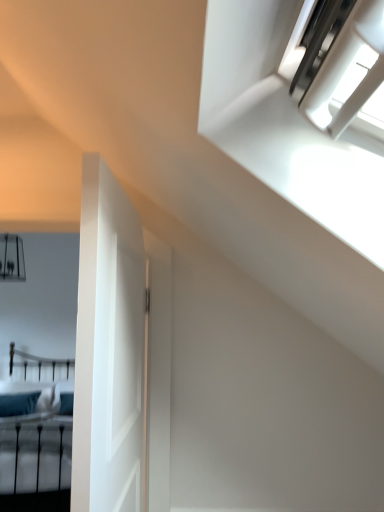
Question: Can you confirm if white matte door at left is wider than teal fabric bed at lower left?

Choices:
 (A) no
 (B) yes

Answer: (A)

Question: Is white matte door at left positioned far away from teal fabric bed at lower left?

Choices:
 (A) yes
 (B) no

Answer: (A)

Question: Is white matte door at left further to camera compared to teal fabric bed at lower left?

Choices:
 (A) no
 (B) yes

Answer: (A)

Question: Considering the relative sizes of white matte door at left and teal fabric bed at lower left in the image provided, is white matte door at left taller than teal fabric bed at lower left?

Choices:
 (A) no
 (B) yes

Answer: (A)

Question: Is white matte door at left beside teal fabric bed at lower left?

Choices:
 (A) no
 (B) yes

Answer: (A)

Question: In terms of width, does teal fabric pillow at lower left look wider or thinner when compared to teal fabric bed at lower left?

Choices:
 (A) thin
 (B) wide

Answer: (A)

Question: From a real-world perspective, is teal fabric pillow at lower left physically located above or below teal fabric bed at lower left?

Choices:
 (A) below
 (B) above

Answer: (B)

Question: From the image's perspective, relative to teal fabric bed at lower left, is teal fabric pillow at lower left above or below?

Choices:
 (A) above
 (B) below

Answer: (A)

Question: Visually, is teal fabric pillow at lower left positioned to the left or to the right of teal fabric bed at lower left?

Choices:
 (A) left
 (B) right

Answer: (A)

Question: Based on their positions, is teal fabric pillow at lower left located to the left or right of white matte door at left?

Choices:
 (A) left
 (B) right

Answer: (A)

Question: From a real-world perspective, is teal fabric pillow at lower left positioned above or below white matte door at left?

Choices:
 (A) above
 (B) below

Answer: (B)

Question: Looking at their shapes, would you say teal fabric pillow at lower left is wider or thinner than white matte door at left?

Choices:
 (A) wide
 (B) thin

Answer: (A)

Question: Would you say teal fabric pillow at lower left is inside or outside white matte door at left?

Choices:
 (A) outside
 (B) inside

Answer: (A)

Question: From the image's perspective, relative to white matte door at left, is teal fabric bed at lower left above or below?

Choices:
 (A) above
 (B) below

Answer: (B)

Question: From a real-world perspective, is teal fabric bed at lower left above or below white matte door at left?

Choices:
 (A) below
 (B) above

Answer: (A)